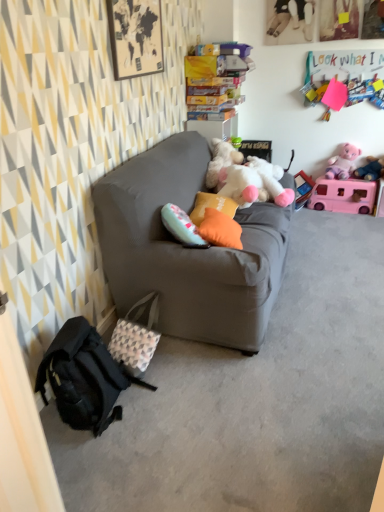
Find the location of a particular element. free space that is in between matte gray couch at center and patterned fabric bag at lower left is located at coordinates click(x=195, y=371).